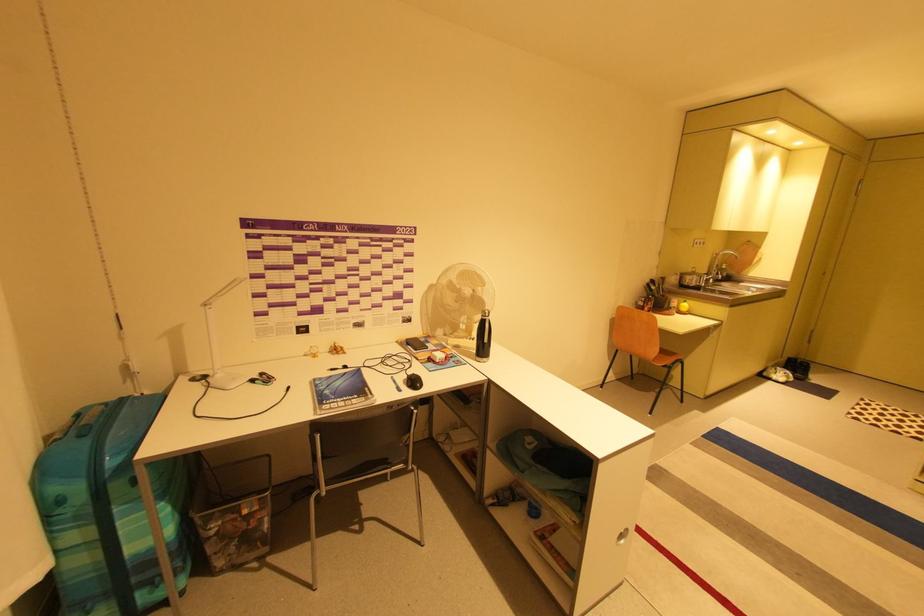
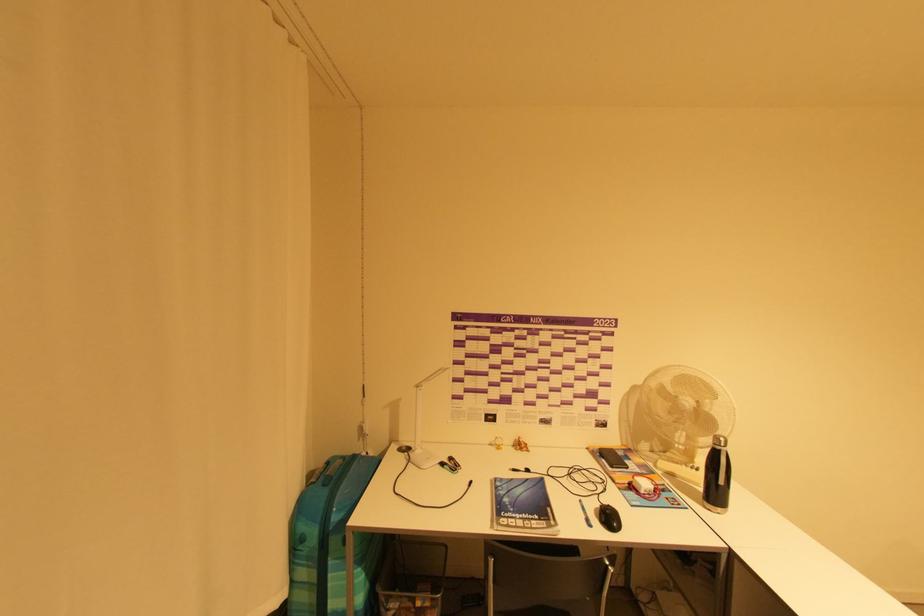
Where in the second image is the point corresponding to (x=435, y=363) from the first image?

(638, 493)